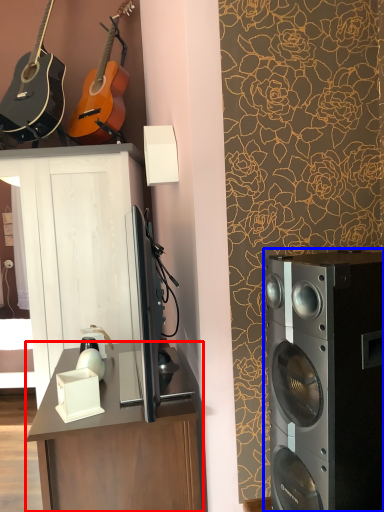
Question: Which object appears closest to the camera in this image, desk (highlighted by a red box) or home appliance (highlighted by a blue box)?

Choices:
 (A) desk
 (B) home appliance

Answer: (B)